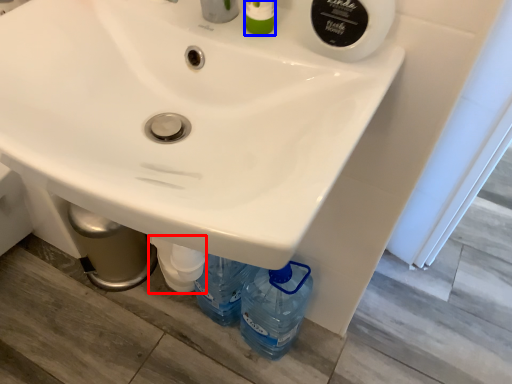
Question: Among these objects, which one is farthest to the camera, bottle (highlighted by a red box) or toiletry (highlighted by a blue box)?

Choices:
 (A) bottle
 (B) toiletry

Answer: (A)